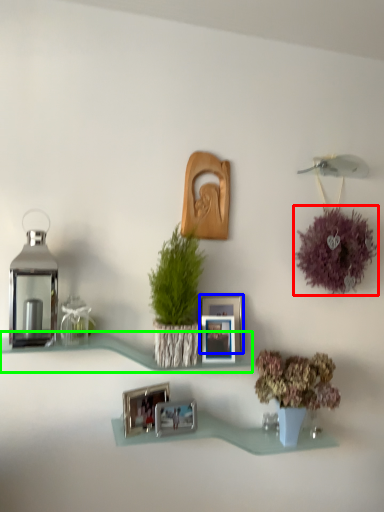
Question: Based on their relative distances, which object is farther from flower (highlighted by a red box)? Choose from picture frame (highlighted by a blue box) and shelf (highlighted by a green box).

Choices:
 (A) picture frame
 (B) shelf

Answer: (B)